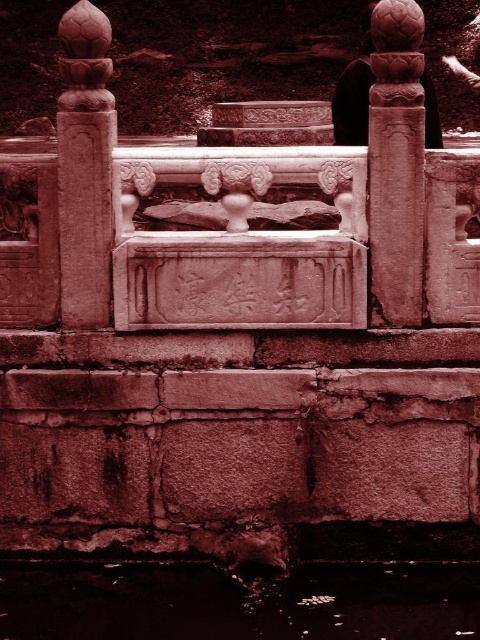
Question: Can you confirm if dark brown water at bottom is thinner than carved stone pillar at upper left?

Choices:
 (A) yes
 (B) no

Answer: (B)

Question: Which of the following is the closest to the observer?

Choices:
 (A) pyautogui.click(x=103, y=108)
 (B) pyautogui.click(x=383, y=154)
 (C) pyautogui.click(x=445, y=628)

Answer: (C)

Question: Does dark brown water at bottom have a greater width compared to carved stone pillar at upper left?

Choices:
 (A) no
 (B) yes

Answer: (B)

Question: Which point is farther from the camera taking this photo?

Choices:
 (A) (389, 84)
 (B) (214, 592)

Answer: (B)

Question: Which point appears farthest from the camera in this image?

Choices:
 (A) (373, 314)
 (B) (76, 76)

Answer: (A)

Question: In this image, where is dark brown water at bottom located relative to carved stone pillar at upper left?

Choices:
 (A) below
 (B) above

Answer: (A)